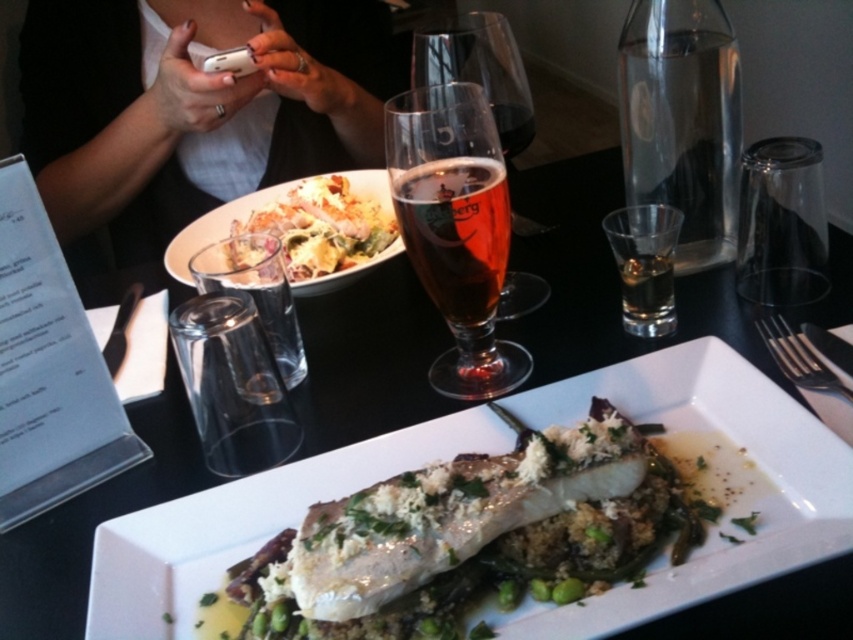
Question: Which object is the closest to the transparent glass carafe at upper right?

Choices:
 (A) white crumbly fish at center
 (B) translucent glass beer at center

Answer: (B)

Question: Does amber glass beer at center appear under translucent glass at center?

Choices:
 (A) no
 (B) yes

Answer: (A)

Question: Among these points, which one is farthest from the camera?

Choices:
 (A) (194, 12)
 (B) (390, 596)

Answer: (A)

Question: Which object is the closest to the white paper menu at left?

Choices:
 (A) white creamy salad at upper center
 (B) transparent glass carafe at upper right

Answer: (A)

Question: Does white fabric shirt at upper left have a lesser width compared to translucent glass beer at center?

Choices:
 (A) no
 (B) yes

Answer: (A)

Question: Can you confirm if translucent glass beer at center is positioned above translucent glass at center?

Choices:
 (A) yes
 (B) no

Answer: (A)